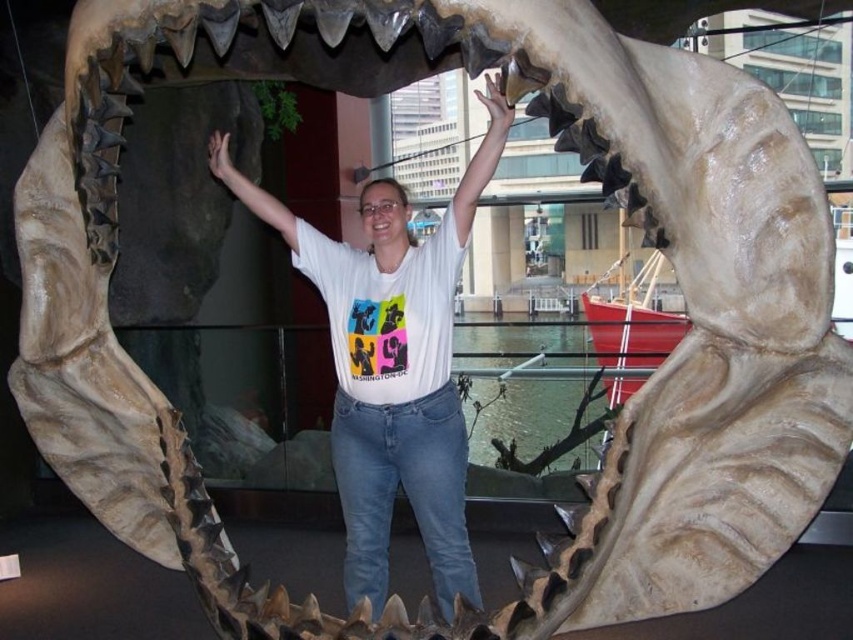
You are standing at the point marked as point (x=421, y=502) in the museum exhibit. The camera is positioned 8.88 feet away from you. If you want to take a selfie with the shark model in the background, would you need to move closer or farther away from the camera to ensure the shark model fits entirely in the frame?

Since you are 8.88 feet away from the camera, you would need to move farther away from the camera to ensure the shark model fits entirely in the frame.